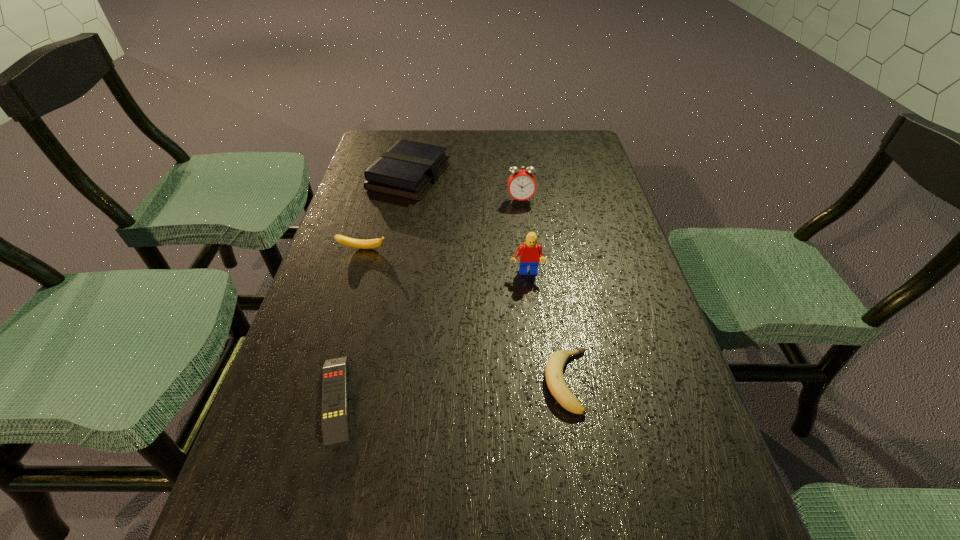
Where is `Lego`? The width and height of the screenshot is (960, 540). Lego is located at coordinates (530, 253).

Locate an element on the screen. alarm clock is located at coordinates (521, 184).

The image size is (960, 540). What are the coordinates of `book` in the screenshot? It's located at (408, 169).

At what (x,y) coordinates should I click in order to perform the action: click on the farther banana. Please return your answer as a coordinate pair (x, y). Looking at the image, I should click on (355, 243).

Image resolution: width=960 pixels, height=540 pixels. What are the coordinates of `the fourth nearest object` in the screenshot? It's located at (355, 243).

I want to click on the right banana, so click(554, 368).

Where is `the shorter banana`? the shorter banana is located at coordinates (554, 368).

At what (x,y) coordinates should I click in order to perform the action: click on remote control. Please return your answer as a coordinate pair (x, y). This screenshot has width=960, height=540. Looking at the image, I should click on 334,418.

Locate an element on the screen. vacant space located on the front-facing side of the fourth farthest object is located at coordinates (531, 315).

The image size is (960, 540). What are the coordinates of `vacant space located on the front-facing side of the alarm clock` in the screenshot? It's located at (523, 222).